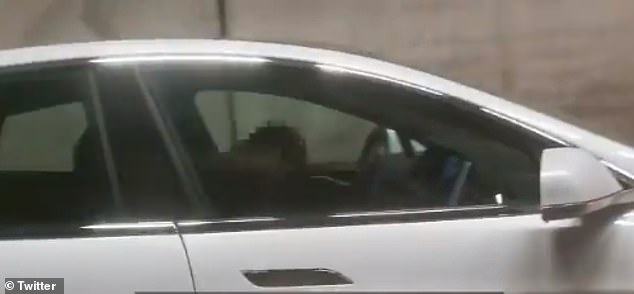
Find the location of a particular element. The height and width of the screenshot is (294, 634). door handle is located at coordinates (309, 275).